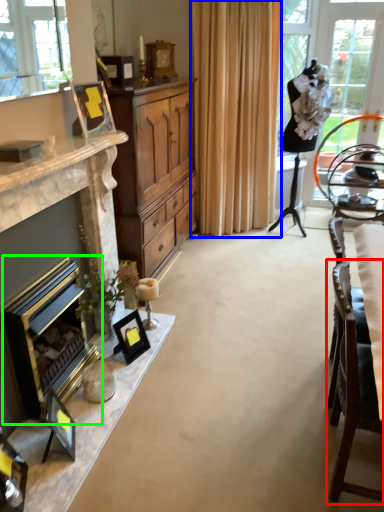
Question: Which is nearer to the chair (highlighted by a red box)? curtain (highlighted by a blue box) or fireplace (highlighted by a green box).

Choices:
 (A) curtain
 (B) fireplace

Answer: (B)